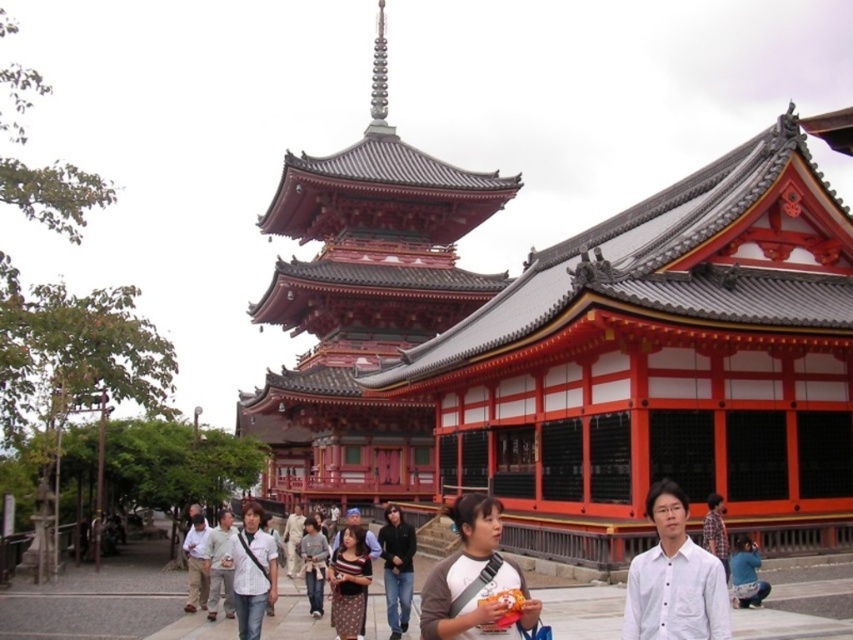
Question: Is red lacquered wood pagoda at center below plaid fabric shirt at center?

Choices:
 (A) no
 (B) yes

Answer: (A)

Question: Which of these objects is positioned closest to the gray fabric jacket at center?

Choices:
 (A) blue denim jeans at lower right
 (B) white matte shirt at center

Answer: (B)

Question: Which object is farther from the camera taking this photo?

Choices:
 (A) matte gray shirt at center
 (B) gray fabric jacket at center
 (C) white matte shirt at center

Answer: (B)

Question: In this image, where is light gray cotton shirt at center located relative to plaid fabric shirt at center?

Choices:
 (A) below
 (B) above

Answer: (A)

Question: Does striped fabric dress at center lie behind blue denim jeans at lower right?

Choices:
 (A) no
 (B) yes

Answer: (A)

Question: Which object appears closest to the camera in this image?

Choices:
 (A) red lacquered wood pagoda at center
 (B) white cotton shirt at lower center
 (C) white matte shirt at center
 (D) gray fabric jacket at center

Answer: (C)